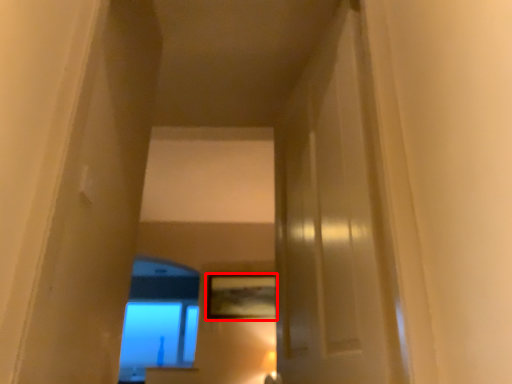
Question: Observing the image, what is the correct spatial positioning of picture frame (annotated by the red box) in reference to window?

Choices:
 (A) left
 (B) right

Answer: (B)